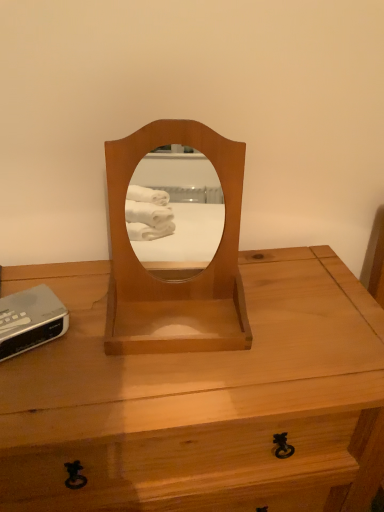
Question: Considering the relative sizes of silver plastic clock at lower left and light brown wood desk at center in the image provided, is silver plastic clock at lower left smaller than light brown wood desk at center?

Choices:
 (A) yes
 (B) no

Answer: (A)

Question: Is silver plastic clock at lower left to the right of light brown wood desk at center from the viewer's perspective?

Choices:
 (A) yes
 (B) no

Answer: (B)

Question: Is silver plastic clock at lower left with light brown wood desk at center?

Choices:
 (A) no
 (B) yes

Answer: (A)

Question: Can you confirm if silver plastic clock at lower left is bigger than light brown wood desk at center?

Choices:
 (A) no
 (B) yes

Answer: (A)

Question: Does silver plastic clock at lower left come behind light brown wood desk at center?

Choices:
 (A) yes
 (B) no

Answer: (A)

Question: From their relative heights in the image, would you say light brown wood desk at center is taller or shorter than silver plastic clock at lower left?

Choices:
 (A) short
 (B) tall

Answer: (B)

Question: Based on their sizes in the image, would you say light brown wood desk at center is bigger or smaller than silver plastic clock at lower left?

Choices:
 (A) big
 (B) small

Answer: (A)

Question: Based on their positions, is light brown wood desk at center located to the left or right of silver plastic clock at lower left?

Choices:
 (A) left
 (B) right

Answer: (B)

Question: From the image's perspective, is light brown wood desk at center positioned above or below silver plastic clock at lower left?

Choices:
 (A) above
 (B) below

Answer: (B)

Question: Visually, is light brown wood mirror at center positioned to the left or to the right of light brown wood desk at center?

Choices:
 (A) right
 (B) left

Answer: (A)

Question: Is light brown wood mirror at center situated inside light brown wood desk at center or outside?

Choices:
 (A) outside
 (B) inside

Answer: (A)

Question: In terms of size, does light brown wood mirror at center appear bigger or smaller than light brown wood desk at center?

Choices:
 (A) big
 (B) small

Answer: (B)

Question: From their relative heights in the image, would you say light brown wood mirror at center is taller or shorter than light brown wood desk at center?

Choices:
 (A) short
 (B) tall

Answer: (A)

Question: Looking at their shapes, would you say silver plastic clock at lower left is wider or thinner than light brown wood desk at center?

Choices:
 (A) wide
 (B) thin

Answer: (B)

Question: Is point (36, 346) positioned closer to the camera than point (180, 384)?

Choices:
 (A) closer
 (B) farther

Answer: (B)